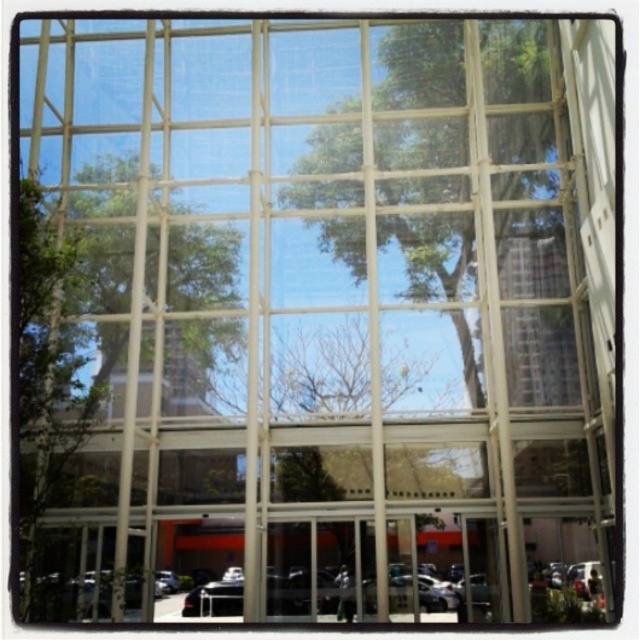
You are standing outside the building and looking at the glass facade. You notice two green leafy trees reflected on the glass. Which tree, the green leafy tree at center or the green leafy tree at upper left, appears closer to you in the reflection?

The green leafy tree at center appears closer to you because it is in front of the green leafy tree at upper left, which is positioned behind it in the reflection.